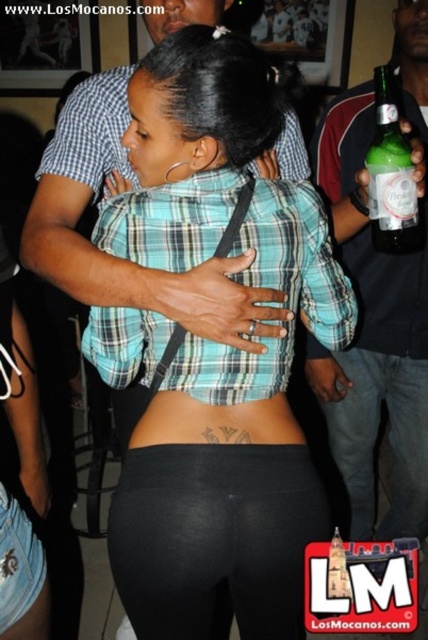
Based on the photo, is matte plaid shirt at center below green plaid shirt at center?

Indeed, matte plaid shirt at center is positioned under green plaid shirt at center.

You are a GUI agent. You are given a task and a screenshot of the screen. Output one action in this format:
    pyautogui.click(x=<x>, y=<y>)
    Task: Click on the matte plaid shirt at center
    This screenshot has height=640, width=428.
    Given the screenshot: What is the action you would take?
    pyautogui.click(x=216, y=499)

Is point (187, 115) positioned behind point (112, 241)?

No, (187, 115) is in front of (112, 241).

Locate an element on the screen. The height and width of the screenshot is (640, 428). matte plaid shirt at center is located at coordinates (216, 499).

How far apart are matte plaid shirt at center and green glass bottle at right?

They are 55.35 centimeters apart.

What are the coordinates of `matte plaid shirt at center` in the screenshot? It's located at (216, 499).

Which is below, black matte leggings at lower center or green glass bottle at right?

black matte leggings at lower center is lower down.

Between black matte leggings at lower center and green glass bottle at right, which one has less height?

Standing shorter between the two is black matte leggings at lower center.

Is point (285, 552) closer to camera compared to point (365, 140)?

That is True.

Locate an element on the screen. The image size is (428, 640). black matte leggings at lower center is located at coordinates (214, 538).